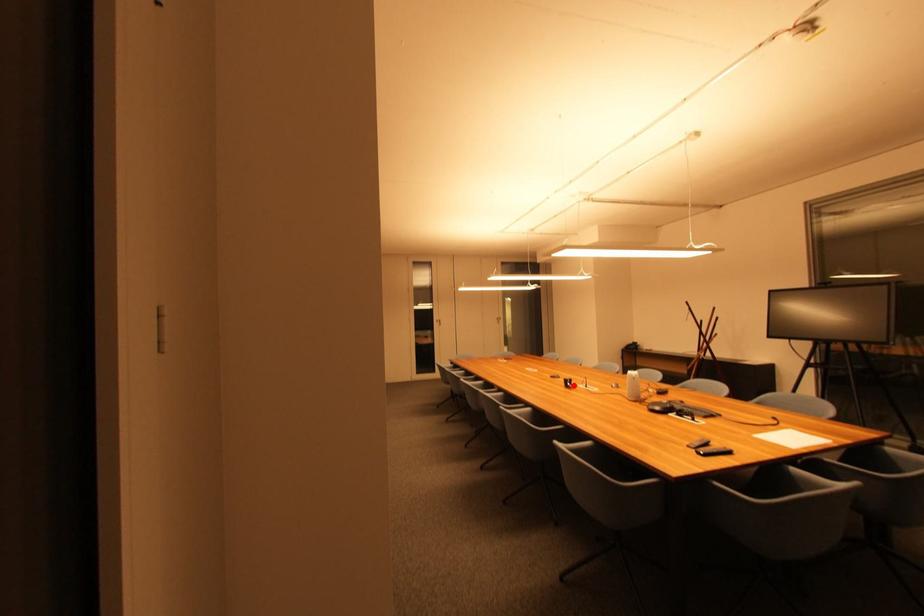
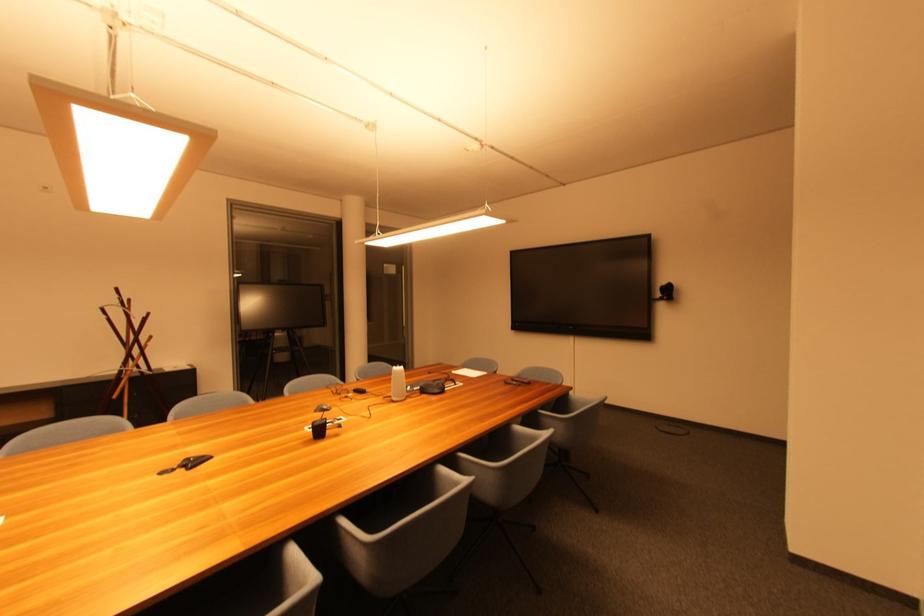
Locate, in the second image, the point that corresponds to the highlighted location in the first image.

(324, 432)